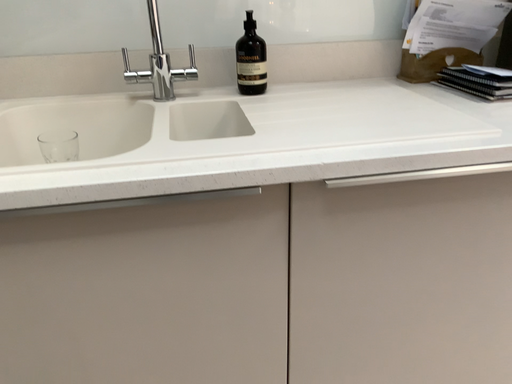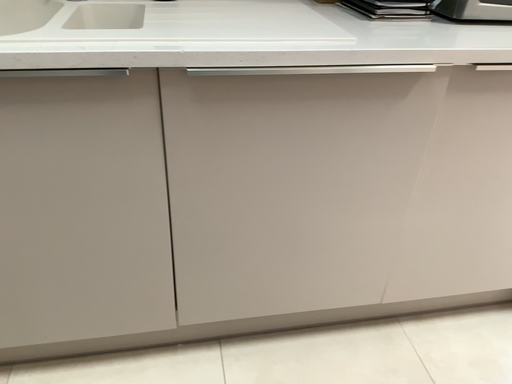
Question: Which way did the camera rotate in the video?

Choices:
 (A) rotated downward
 (B) rotated upward

Answer: (A)